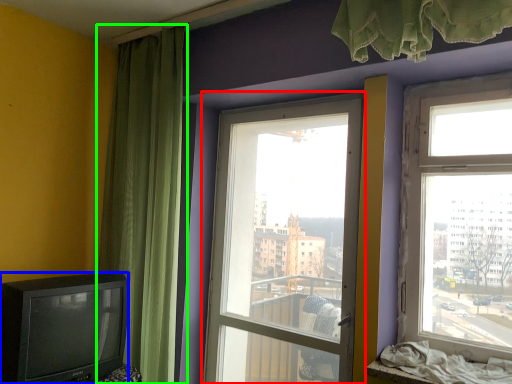
Question: Which object is the closest to the window (highlighted by a red box)? Choose among these: television (highlighted by a blue box) or curtain (highlighted by a green box).

Choices:
 (A) television
 (B) curtain

Answer: (B)